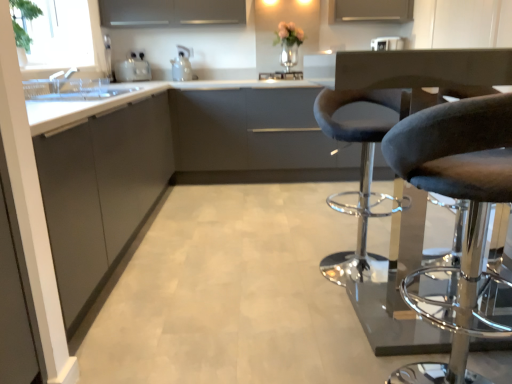
Question: Is gray fabric swivel chair at right at the left side of satin silver toaster at left, placed as the third appliance when sorted from right to left?

Choices:
 (A) no
 (B) yes

Answer: (A)

Question: From the image's perspective, is gray fabric swivel chair at right over satin silver toaster at left, which ranks as the first appliance in left-to-right order?

Choices:
 (A) yes
 (B) no

Answer: (B)

Question: Can you see gray fabric swivel chair at right touching satin silver toaster at left, which ranks as the first appliance in left-to-right order?

Choices:
 (A) yes
 (B) no

Answer: (B)

Question: Is gray fabric swivel chair at right thinner than satin silver toaster at left, placed as the third appliance when sorted from right to left?

Choices:
 (A) no
 (B) yes

Answer: (A)

Question: Can satin silver toaster at left, which ranks as the first appliance in left-to-right order, be found inside gray fabric swivel chair at right?

Choices:
 (A) no
 (B) yes

Answer: (A)

Question: Considering the positions of point [164, 4] and point [396, 46], is point [164, 4] closer or farther from the camera than point [396, 46]?

Choices:
 (A) closer
 (B) farther

Answer: (A)

Question: Relative to white glossy toaster at upper center, the 1th appliance viewed from the right, is matte gray cabinet at upper center, marked as the 3th cabinetry in a front-to-back arrangement, in front or behind?

Choices:
 (A) behind
 (B) front

Answer: (A)

Question: Is matte gray cabinet at upper center, marked as the 3th cabinetry in a front-to-back arrangement, wider or thinner than white glossy toaster at upper center, the 1th appliance viewed from the right?

Choices:
 (A) thin
 (B) wide

Answer: (A)

Question: Do you think matte gray cabinet at upper center, marked as the 3th cabinetry in a front-to-back arrangement, is within white glossy toaster at upper center, marked as the third appliance in a left-to-right arrangement, or outside of it?

Choices:
 (A) outside
 (B) inside

Answer: (A)

Question: Relative to gray fabric swivel chair at right, is matte gray cabinet at center, arranged as the 2th cabinetry when viewed from the front, in front or behind?

Choices:
 (A) behind
 (B) front

Answer: (A)

Question: Is point [x=239, y=127] positioned closer to the camera than point [x=330, y=127]?

Choices:
 (A) farther
 (B) closer

Answer: (A)

Question: Would you say matte gray cabinet at center, the 2th cabinetry positioned from the back, is to the left or to the right of gray fabric swivel chair at right in the picture?

Choices:
 (A) left
 (B) right

Answer: (A)

Question: From their relative heights in the image, would you say matte gray cabinet at center, the 2th cabinetry positioned from the back, is taller or shorter than gray fabric swivel chair at right?

Choices:
 (A) short
 (B) tall

Answer: (B)

Question: From the image's perspective, is matte gray cabinet at center, the 2th cabinetry positioned from the back, positioned above or below white glossy toaster at upper center, the 1th appliance viewed from the right?

Choices:
 (A) below
 (B) above

Answer: (A)

Question: In terms of width, does matte gray cabinet at center, the 2th cabinetry positioned from the back, look wider or thinner when compared to white glossy toaster at upper center, the 1th appliance viewed from the right?

Choices:
 (A) thin
 (B) wide

Answer: (B)